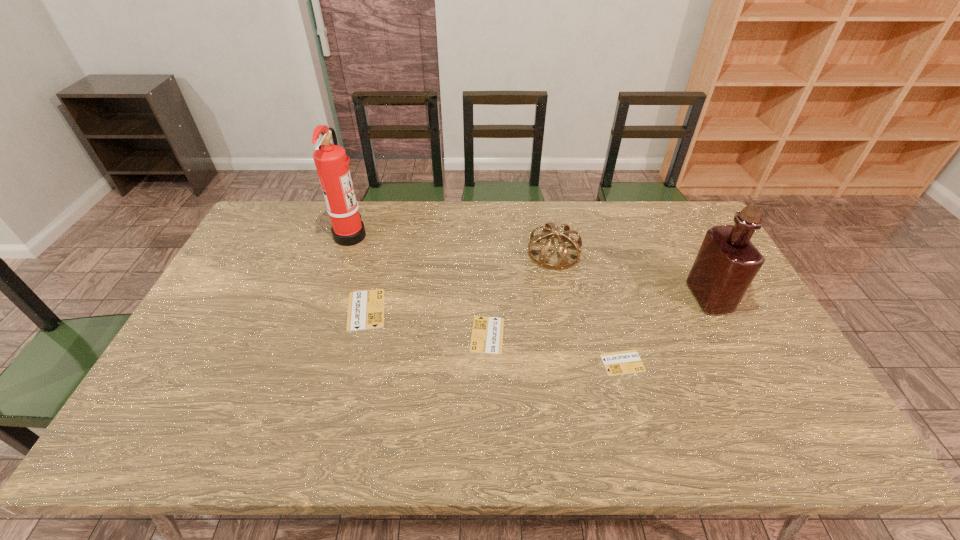
I want to click on liquor, so click(x=727, y=262).

At what (x,y) coordinates should I click in order to perform the action: click on vacant region located 0.300m on the left of the leftmost identity card. Please return your answer as a coordinate pair (x, y). This screenshot has width=960, height=540. Looking at the image, I should click on (242, 310).

In order to click on vacant space situated on the right of the second identity card from left to right in this screenshot , I will do `click(548, 335)`.

This screenshot has height=540, width=960. What are the coordinates of `vacant space situated on the left of the shortest object` in the screenshot? It's located at (564, 363).

Image resolution: width=960 pixels, height=540 pixels. Find the location of `vacant space located at the nozzle of the leftmost object`. vacant space located at the nozzle of the leftmost object is located at coordinates (473, 234).

The image size is (960, 540). I want to click on vacant space located on the front of the tiara, so click(x=564, y=309).

Find the location of a particular element. This screenshot has height=540, width=960. vacant space positioned 0.320m on the back of the fifth shortest object is located at coordinates [x=667, y=217].

The height and width of the screenshot is (540, 960). I want to click on fire extinguisher present at the far edge, so click(x=331, y=163).

Where is `tiara that is positioned at the far edge`? The image size is (960, 540). tiara that is positioned at the far edge is located at coordinates (563, 264).

Where is `object at the right edge`? This screenshot has height=540, width=960. object at the right edge is located at coordinates (727, 262).